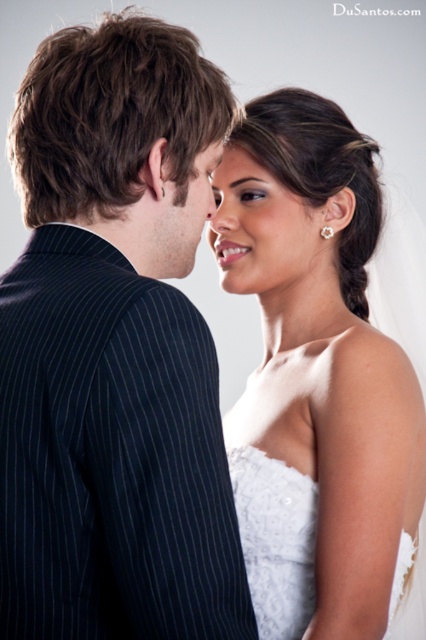
You are a photographer adjusting the lighting for a portrait. You notice the white lace dress at right and the smooth skin forehead at upper center. Which object should you focus on to ensure proper exposure for the face?

The smooth skin forehead at upper center should be focused on for proper exposure since it is behind the white lace dress at right, making it the primary subject needing accurate lighting.

You are a photographer trying to capture the perfect shot of the couple. The man is on the left side of the frame, and the woman is wearing a white lace dress at right. Based on their positions, where should you focus your camera to ensure both subjects are in the frame?

The white lace dress at right is located at point (319, 385), so you should focus your camera near the center of the frame to include both the man on the left and the woman in the white lace dress at right.

You are a photographer adjusting the focus on your camera. You need to ensure that both the white lace dress at right and the smooth skin face at center are in focus. Given their sizes, which object should you adjust the focus on first to ensure clarity?

The white lace dress at right has a larger size compared to the smooth skin face at center, so you should adjust the focus on the white lace dress at right first to ensure clarity.